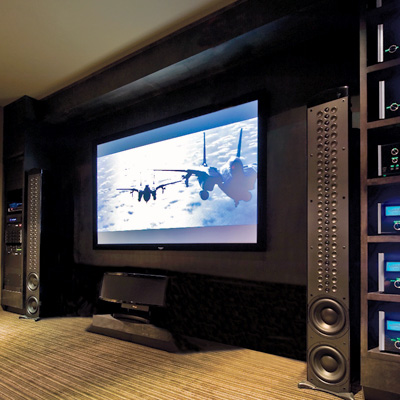
Locate an element on the screen. The image size is (400, 400). speaker is located at coordinates (31, 252), (322, 240).